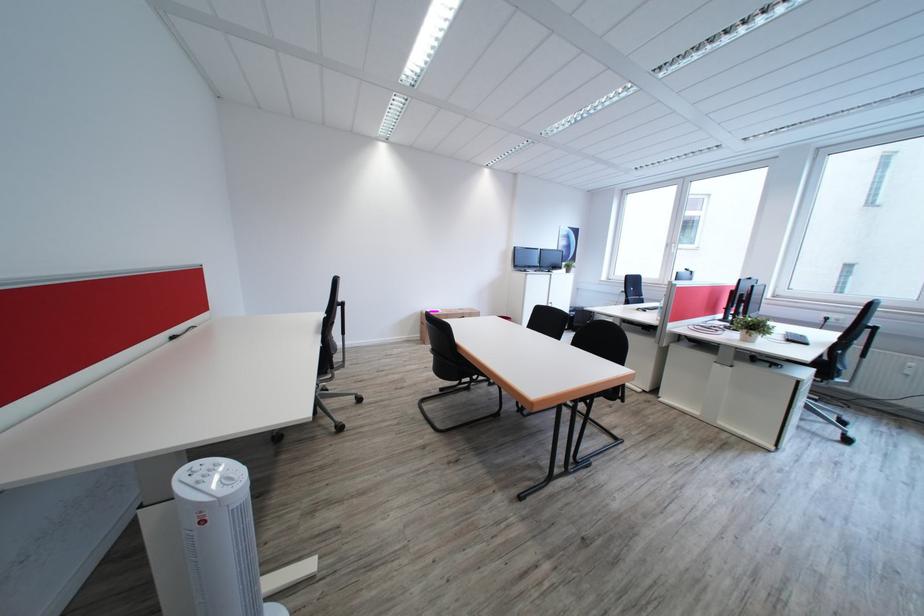
This screenshot has width=924, height=616. In order to click on small plant pot in this screenshot , I will do `click(751, 328)`.